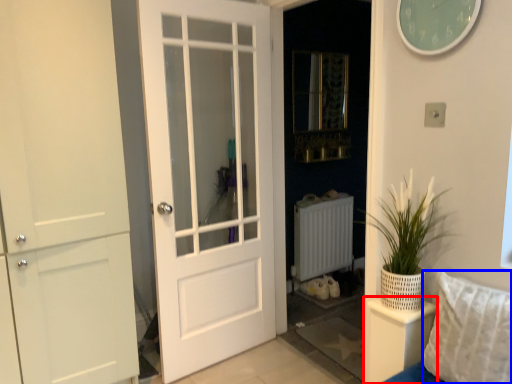
Question: Which of the following is the closest to the observer, furniture (highlighted by a red box) or pillow (highlighted by a blue box)?

Choices:
 (A) furniture
 (B) pillow

Answer: (B)